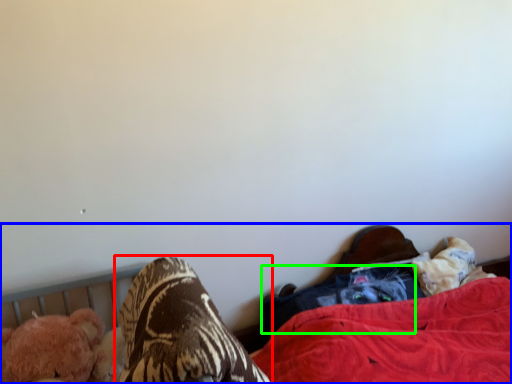
Question: Based on their relative distances, which object is farther from footwear (highlighted by a red box)? Choose from bed (highlighted by a blue box) and clothing (highlighted by a green box).

Choices:
 (A) bed
 (B) clothing

Answer: (A)